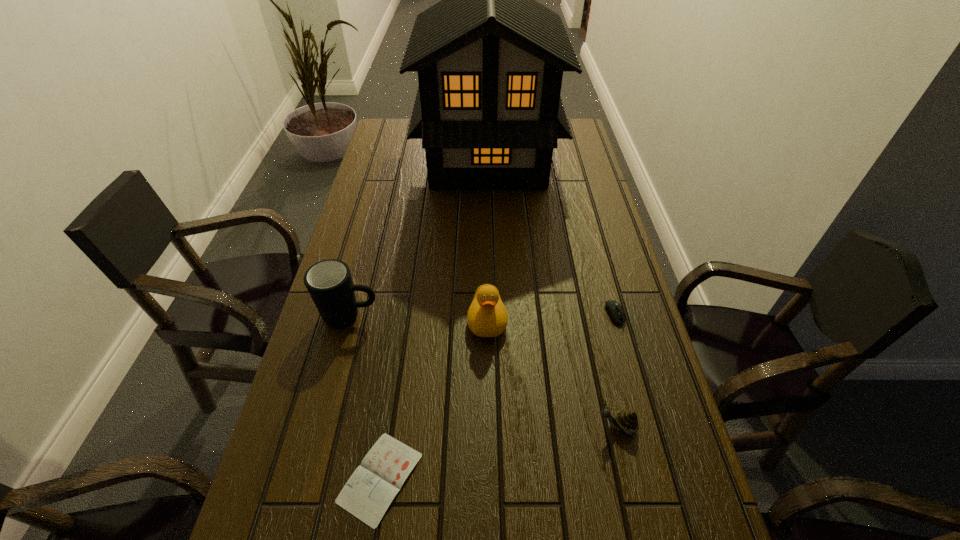
This screenshot has width=960, height=540. Find the location of `free space located 0.220m on the face of the fourth shortest object`. free space located 0.220m on the face of the fourth shortest object is located at coordinates (489, 430).

Locate an element on the screen. This screenshot has width=960, height=540. free location located 0.190m on the face of the third shortest object is located at coordinates (504, 426).

Locate an element on the screen. free space located 0.250m on the face of the third shortest object is located at coordinates (475, 426).

Locate an element on the screen. This screenshot has height=540, width=960. free space located 0.160m on the face of the third shortest object is located at coordinates (518, 426).

Find the location of a particular element. The width and height of the screenshot is (960, 540). vacant space located 0.320m on the left of the computer mouse is located at coordinates (482, 315).

Where is `free point located 0.190m on the right of the shortest object`? The width and height of the screenshot is (960, 540). free point located 0.190m on the right of the shortest object is located at coordinates (518, 478).

Locate an element on the screen. Image resolution: width=960 pixels, height=540 pixels. object that is at the far edge is located at coordinates (490, 59).

Image resolution: width=960 pixels, height=540 pixels. I want to click on mug that is at the left edge, so click(x=329, y=283).

Locate an element on the screen. diary that is at the left edge is located at coordinates point(370,490).

Find the location of a particular element. dollhouse at the right edge is located at coordinates (490, 59).